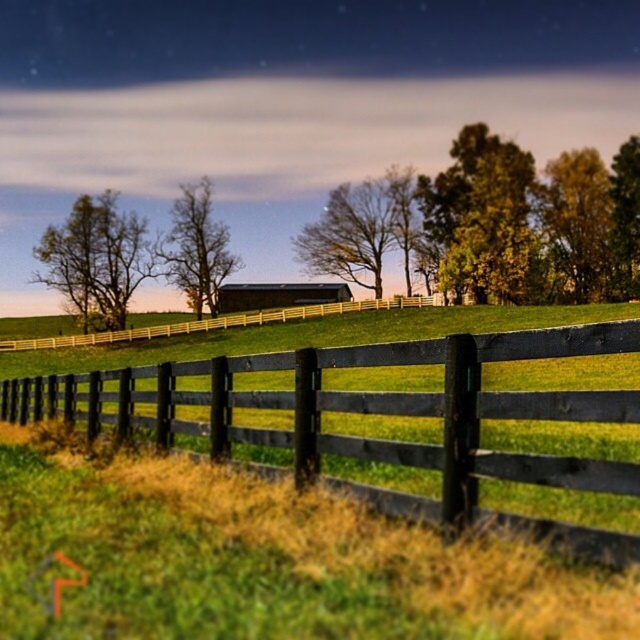
Can you confirm if black wooden fence at center is thinner than dark gray wooden barn at center?

No.

In the scene shown: Is black wooden fence at center positioned in front of dark gray wooden barn at center?

Yes, black wooden fence at center is closer to the viewer.

The width and height of the screenshot is (640, 640). What do you see at coordinates (400, 422) in the screenshot?
I see `black wooden fence at center` at bounding box center [400, 422].

At what (x,y) coordinates should I click in order to perform the action: click on black wooden fence at center. Please return your answer as a coordinate pair (x, y). This screenshot has width=640, height=640. Looking at the image, I should click on (400, 422).

Is point (218, 326) positioned behind point (314, 300)?

No, it is in front of (314, 300).

Does brown wooden fence at center lie in front of dark gray wooden barn at center?

Yes, it is in front of dark gray wooden barn at center.

Is point (257, 312) farther from viewer compared to point (317, 301)?

No, (257, 312) is in front of (317, 301).

I want to click on brown wooden fence at center, so click(x=212, y=323).

Is black wooden fence at center wider than brown wooden fence at center?

No.

Is black wooden fence at center taller than brown wooden fence at center?

No, black wooden fence at center is not taller than brown wooden fence at center.

Is point (573, 467) closer to camera compared to point (291, 314)?

Yes, it is.

Where is `black wooden fence at center`? This screenshot has width=640, height=640. black wooden fence at center is located at coordinates tap(400, 422).